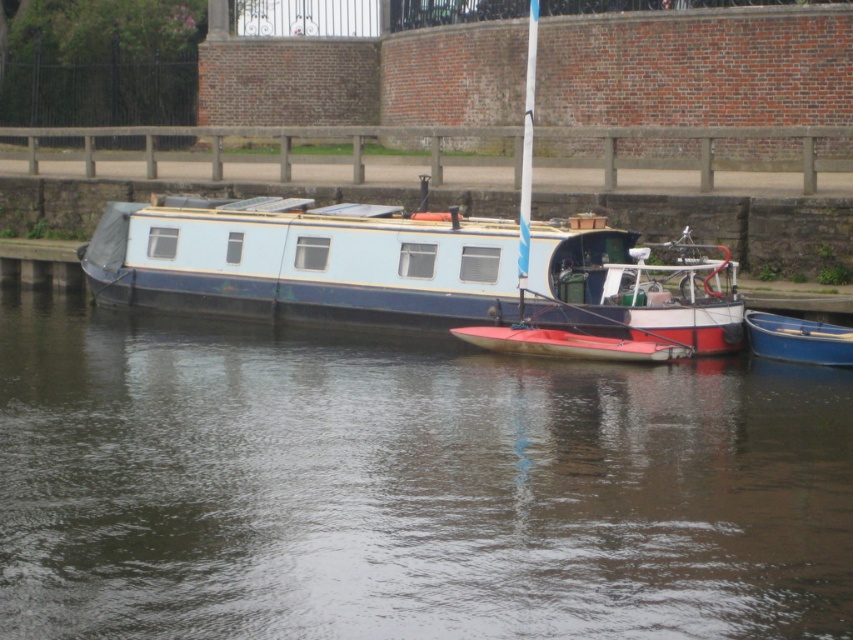
Is point (682, 426) less distant than point (317, 275)?

That is True.

Between smooth water at center and blue painted wood houseboat at center, which one has less height?

blue painted wood houseboat at center

Image resolution: width=853 pixels, height=640 pixels. Identify the location of smooth water at center. (402, 484).

Between smooth water at center and blue plastic boat at lower right, which one is positioned higher?

blue plastic boat at lower right is above.

Is point (132, 346) less distant than point (801, 339)?

No, (132, 346) is behind (801, 339).

Which is in front, point (428, 611) or point (828, 328)?

Point (428, 611) is more forward.

Locate an element on the screen. This screenshot has height=640, width=853. smooth water at center is located at coordinates (402, 484).

Who is positioned more to the left, blue painted wood houseboat at center or blue plastic boat at lower right?

blue painted wood houseboat at center

Between blue painted wood houseboat at center and blue plastic boat at lower right, which one has more height?

blue painted wood houseboat at center

Does point (637, 317) come closer to viewer compared to point (811, 340)?

No, (637, 317) is behind (811, 340).

This screenshot has height=640, width=853. Identify the location of blue painted wood houseboat at center. (405, 269).